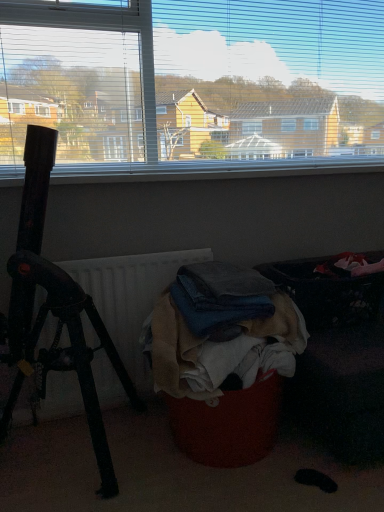
Question: Considering the positions of black matte tripod at left and denim fabric clothes at center in the image, is black matte tripod at left bigger or smaller than denim fabric clothes at center?

Choices:
 (A) small
 (B) big

Answer: (B)

Question: From a real-world perspective, is black matte tripod at left physically located above or below denim fabric clothes at center?

Choices:
 (A) above
 (B) below

Answer: (A)

Question: Based on their relative distances, which object is farther from the black matte tripod at left?

Choices:
 (A) denim fabric clothes at center
 (B) dark fabric laundry basket at right
 (C) textured fabric laundry basket at lower right
 (D) white matte radiator at center

Answer: (B)

Question: Which of these objects is positioned farthest from the black matte tripod at left?

Choices:
 (A) dark fabric laundry basket at right
 (B) denim fabric clothes at center
 (C) textured fabric laundry basket at lower right
 (D) white matte radiator at center

Answer: (A)